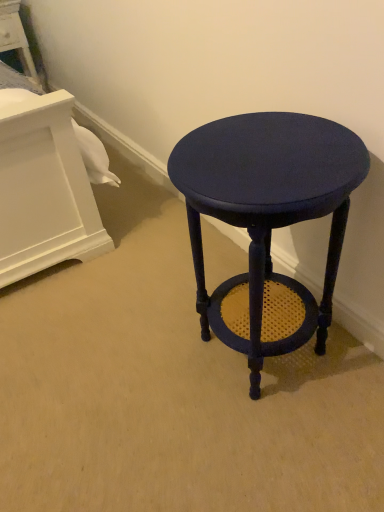
At what (x,y) coordinates should I click in order to perform the action: click on navy fabric stool at center. Please return your answer as a coordinate pair (x, y). This screenshot has height=512, width=384. Looking at the image, I should click on (267, 221).

Describe the element at coordinates (267, 221) in the screenshot. The width and height of the screenshot is (384, 512). I see `navy fabric stool at center` at that location.

Find the location of `navy fabric stool at center`. navy fabric stool at center is located at coordinates (267, 221).